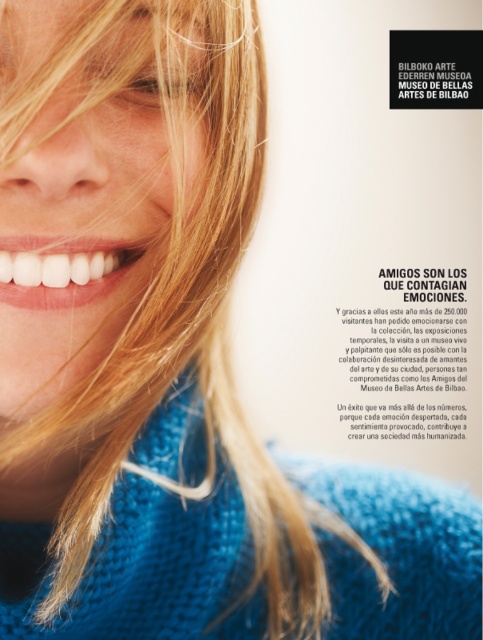
Can you confirm if blonde hair at upper left is positioned below white glossy teeth at center?

Actually, blonde hair at upper left is above white glossy teeth at center.

Can you confirm if blonde hair at upper left is smaller than white glossy teeth at center?

Actually, blonde hair at upper left might be larger than white glossy teeth at center.

Who is more distant from viewer, [62,356] or [107,276]?

The point [107,276] is behind.

At what (x,y) coordinates should I click in order to perform the action: click on blonde hair at upper left. Please return your answer as a coordinate pair (x, y). Looking at the image, I should click on (84, 241).